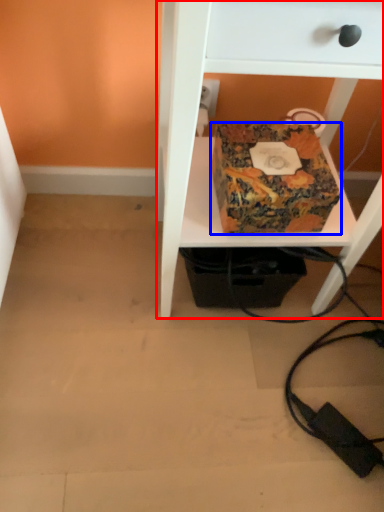
Question: Which point is further to the camera, furniture (highlighted by a red box) or box (highlighted by a blue box)?

Choices:
 (A) furniture
 (B) box

Answer: (B)